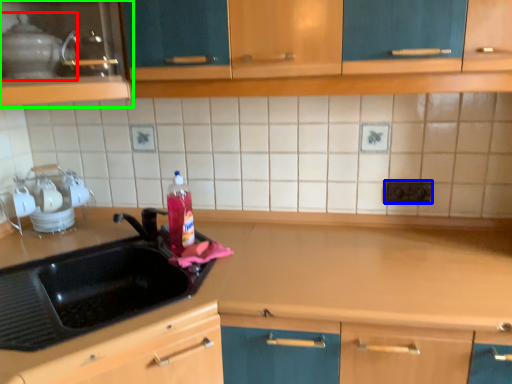
Question: Considering the real-world distances, which object is closest to appliance (highlighted by a red box)? electric outlet (highlighted by a blue box) or cabinetry (highlighted by a green box).

Choices:
 (A) electric outlet
 (B) cabinetry

Answer: (B)